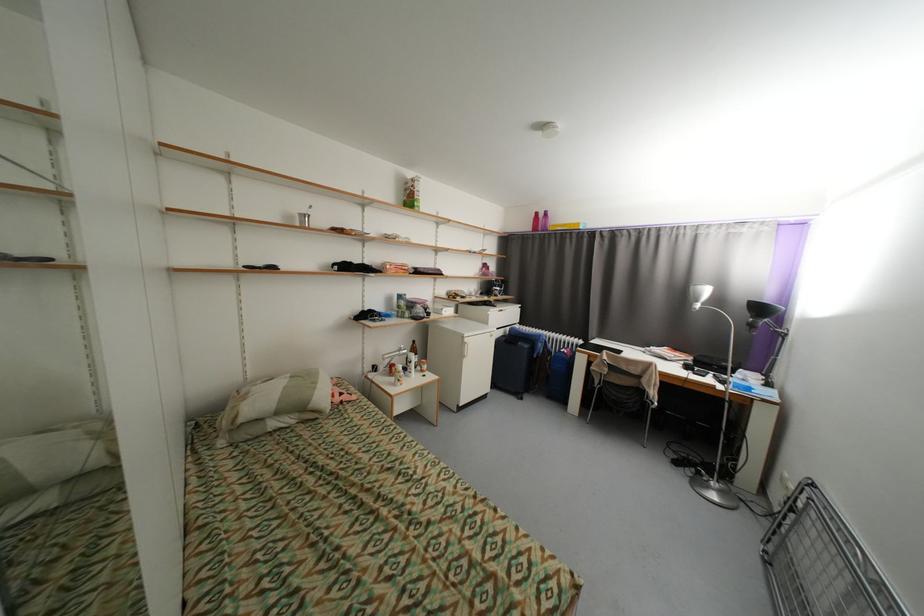
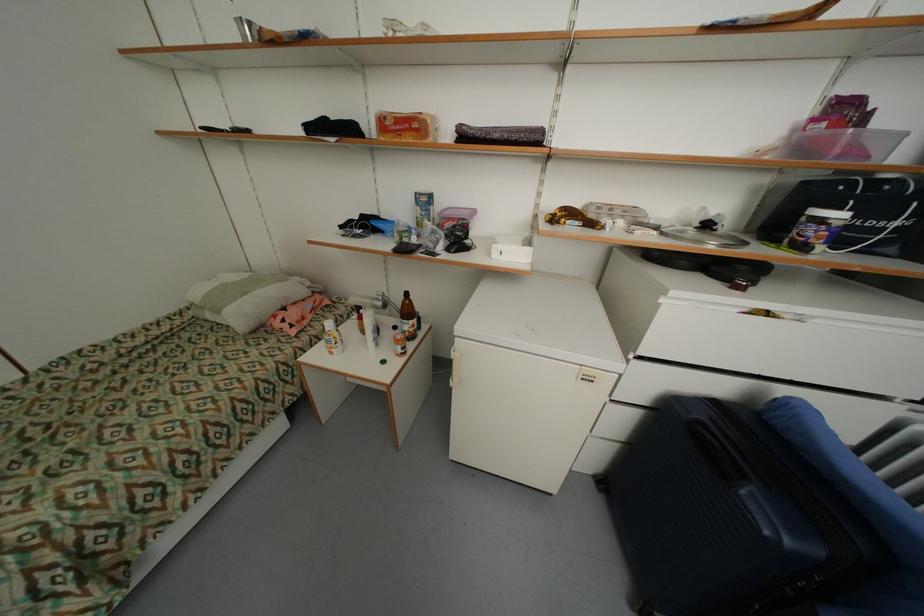
The point at (504, 293) is marked in the first image. Where is the corresponding point in the second image?

(819, 233)